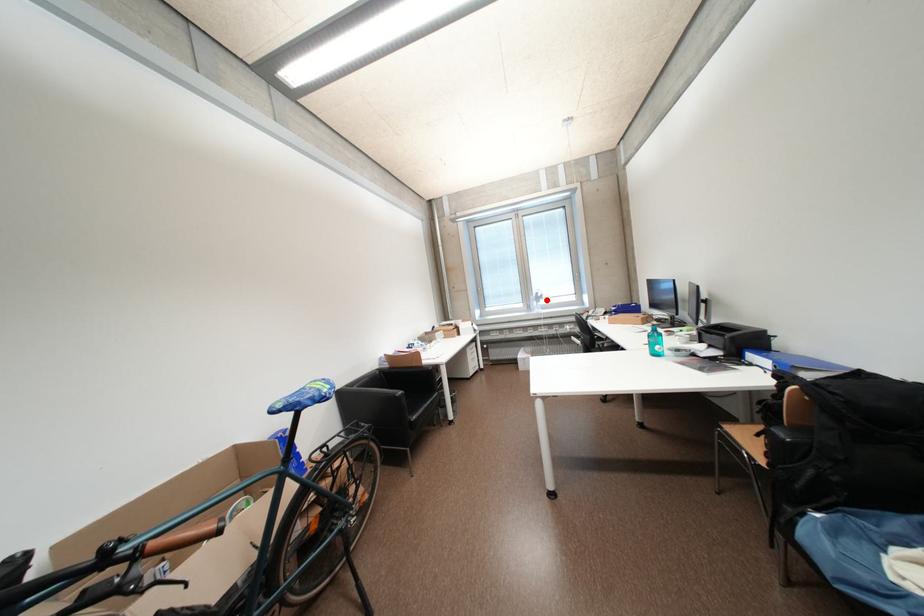
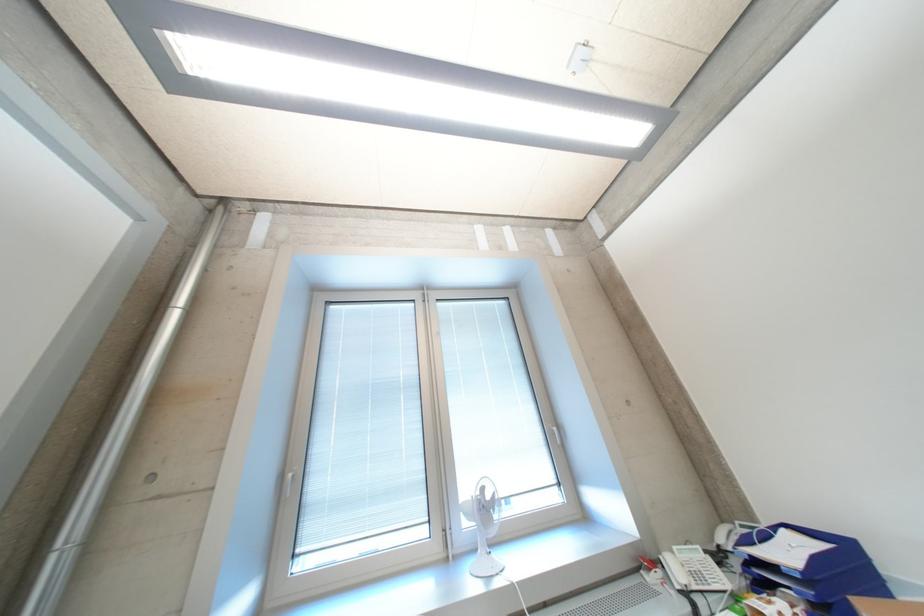
Question: I am providing you with two images of the same scene from different viewpoints. Given a red point in image1, look at the same physical point in image2. Is it:

Choices:
 (A) Closer to the viewpoint
 (B) Farther from the viewpoint

Answer: (B)